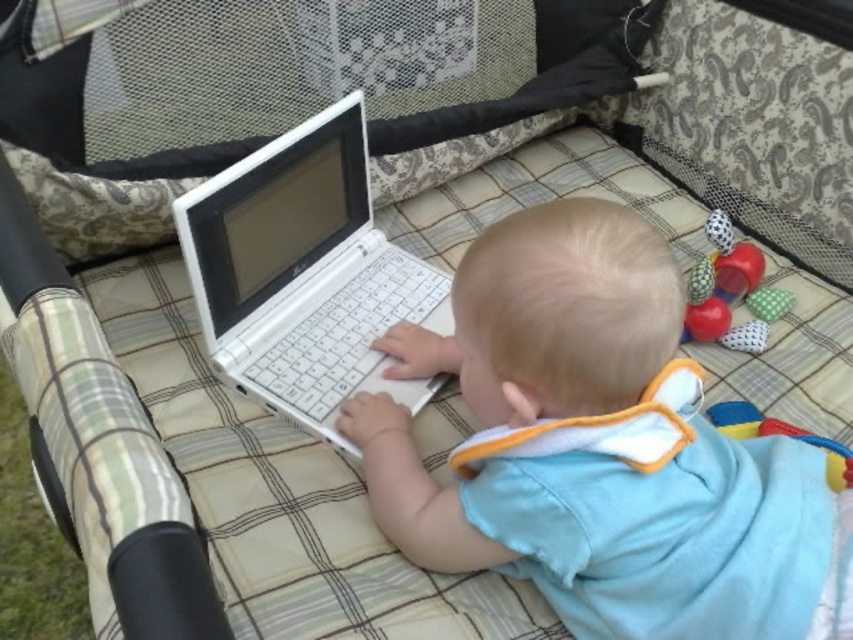
Question: Which object appears farthest from the camera in this image?

Choices:
 (A) rubberized plastic ball at upper right
 (B) light blue fabric baby at center

Answer: (A)

Question: Is white plastic laptop at center to the right of rubberized plastic ball at upper right from the viewer's perspective?

Choices:
 (A) no
 (B) yes

Answer: (A)

Question: Among these points, which one is nearest to the camera?

Choices:
 (A) (306, 320)
 (B) (744, 349)
 (C) (755, 525)

Answer: (C)

Question: Among these points, which one is nearest to the camera?

Choices:
 (A) (730, 266)
 (B) (666, 308)
 (C) (373, 337)

Answer: (B)

Question: From the image, what is the correct spatial relationship of light blue fabric baby at center in relation to rubberized plastic ball at upper right?

Choices:
 (A) above
 (B) below

Answer: (B)

Question: Does light blue fabric baby at center have a lesser width compared to rubberized plastic ball at upper right?

Choices:
 (A) yes
 (B) no

Answer: (B)